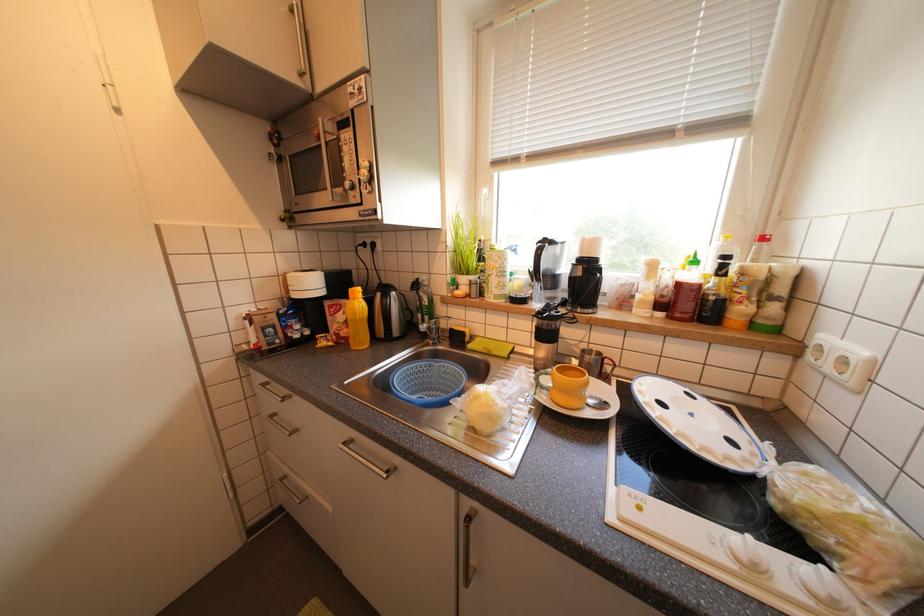
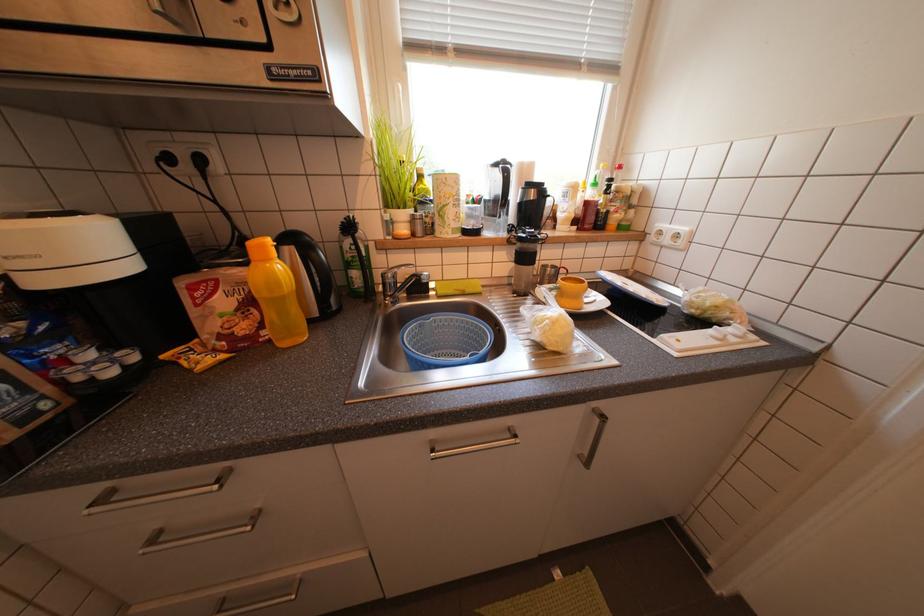
Based on the continuous images, in which direction is the camera rotating?

The rotation direction of the camera is right-down.